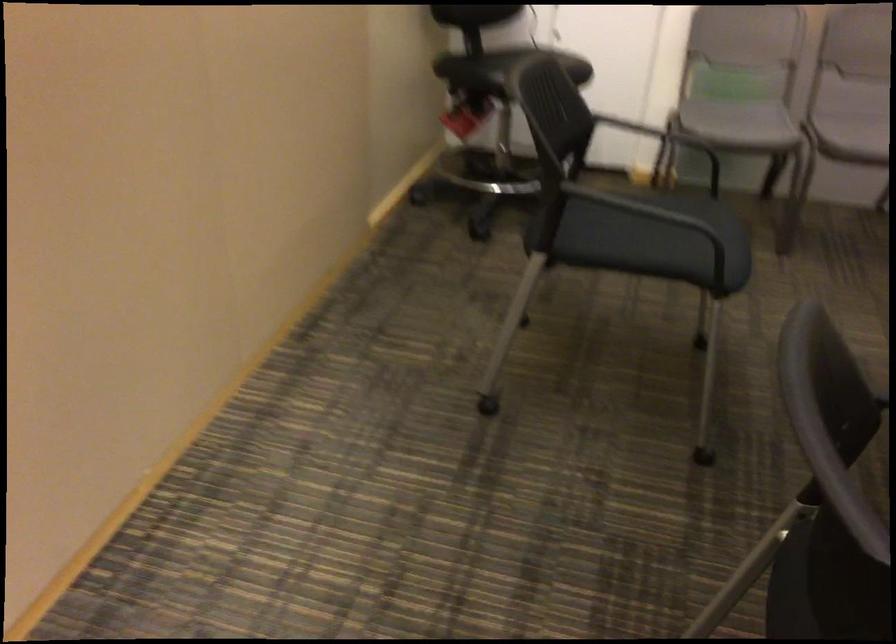
You are a GUI agent. You are given a task and a screenshot of the screen. Output one action in this format:
    pyautogui.click(x=<x>, y=<y>)
    Task: Click on the black chair armrest
    
    Given the screenshot: What is the action you would take?
    pyautogui.click(x=657, y=222)